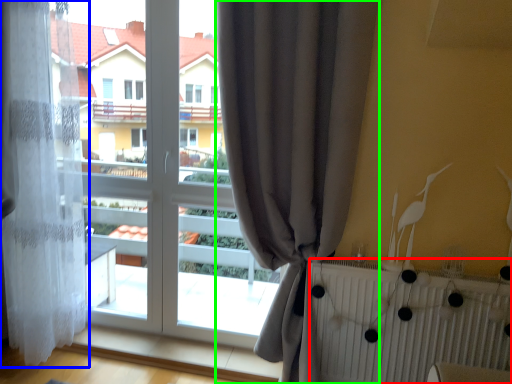
Question: Based on their relative distances, which object is nearer to radiator (highlighted by a red box)? Choose from curtain (highlighted by a blue box) and curtain (highlighted by a green box).

Choices:
 (A) curtain
 (B) curtain

Answer: (B)